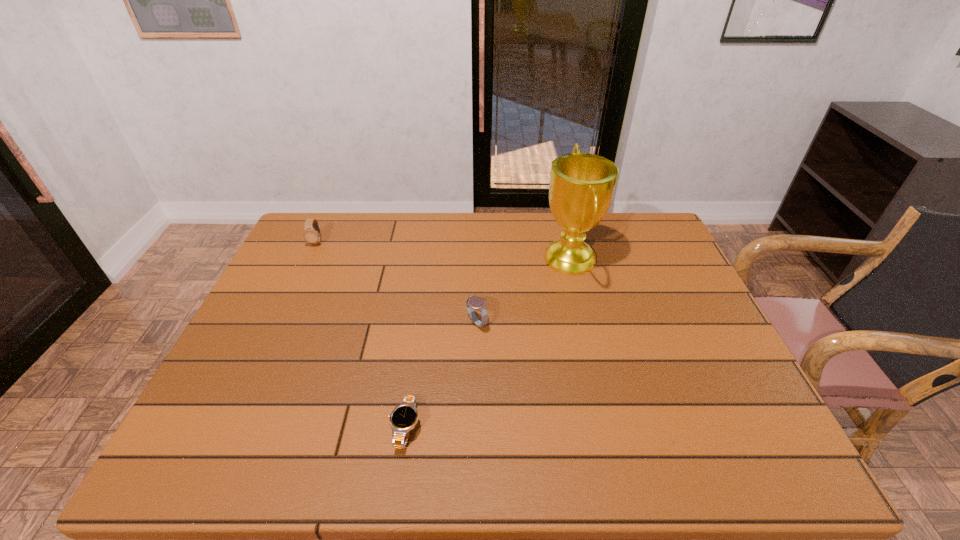
Where is `free space between the award and the farthest watch`? The height and width of the screenshot is (540, 960). free space between the award and the farthest watch is located at coordinates (444, 251).

The height and width of the screenshot is (540, 960). What are the coordinates of `blank region between the rightmost object and the farthest watch` in the screenshot? It's located at (444, 251).

The height and width of the screenshot is (540, 960). What are the coordinates of `free space that is in between the tallest object and the leftmost watch` in the screenshot? It's located at (444, 251).

Select which object appears as the second closest to the third object from left to right. Please provide its 2D coordinates. Your answer should be formatted as a tuple, i.e. [(x, y)], where the tuple contains the x and y coordinates of a point satisfying the conditions above.

[(404, 417)]

At what (x,y) coordinates should I click in order to perform the action: click on the second closest object to the second nearest object. Please return your answer as a coordinate pair (x, y). Looking at the image, I should click on (404, 417).

At what (x,y) coordinates should I click in order to perform the action: click on watch that is the second closest to the rightmost object. Please return your answer as a coordinate pair (x, y). Looking at the image, I should click on (404, 417).

Point out which watch is positioned as the nearest to the tallest object. Please provide its 2D coordinates. Your answer should be formatted as a tuple, i.e. [(x, y)], where the tuple contains the x and y coordinates of a point satisfying the conditions above.

[(472, 302)]

Identify the location of free space that satisfies the following two spatial constraints: 1. on the face of the farthest watch; 2. on the left side of the shortest watch. (229, 428).

Where is `free spot that satisfies the following two spatial constraints: 1. on the face of the nearest object; 2. on the right side of the leftmost watch`? Image resolution: width=960 pixels, height=540 pixels. free spot that satisfies the following two spatial constraints: 1. on the face of the nearest object; 2. on the right side of the leftmost watch is located at coordinates (229, 428).

The image size is (960, 540). Find the location of `vacant space that satisfies the following two spatial constraints: 1. on the face of the second nearest watch; 2. on the left side of the farthest watch`. vacant space that satisfies the following two spatial constraints: 1. on the face of the second nearest watch; 2. on the left side of the farthest watch is located at coordinates (278, 322).